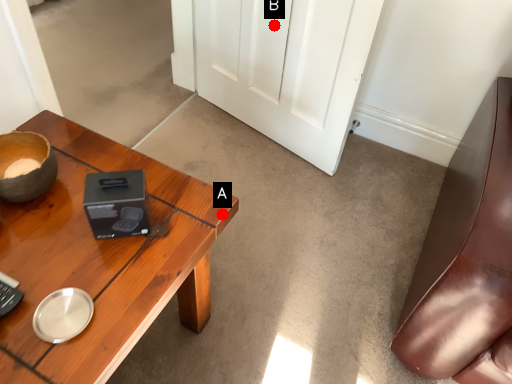
Question: Two points are circled on the image, labeled by A and B beside each circle. Which point appears farthest from the camera in this image?

Choices:
 (A) A is further
 (B) B is further

Answer: (B)